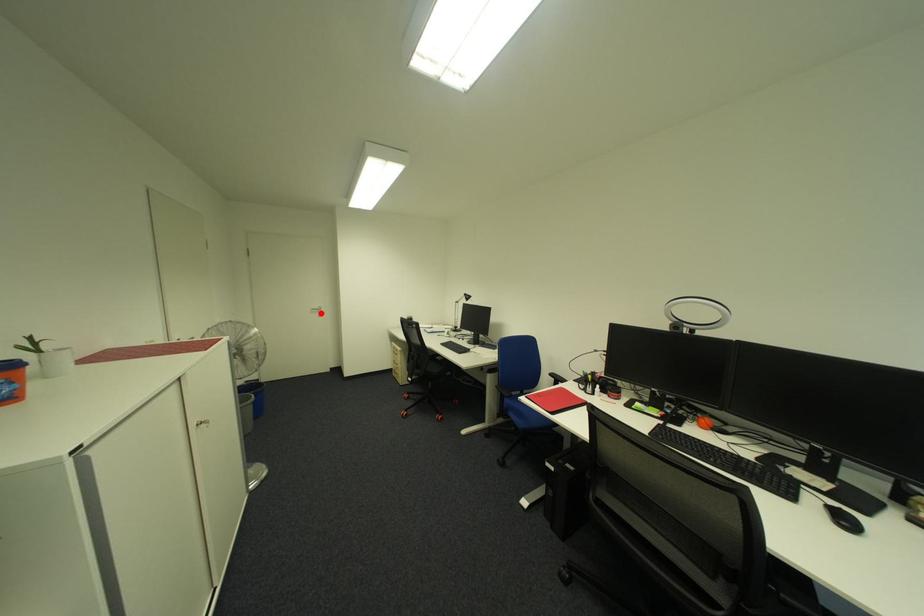
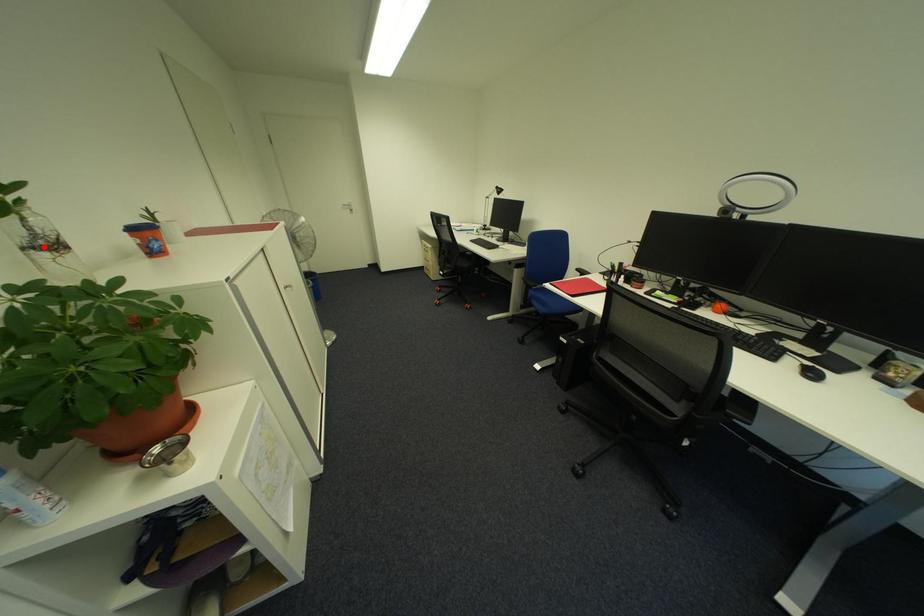
I am providing you with two images of the same scene from different viewpoints. A red point is marked on the first image and another point is marked on the second image. Is the marked point in image1 the same physical position as the marked point in image2?

No